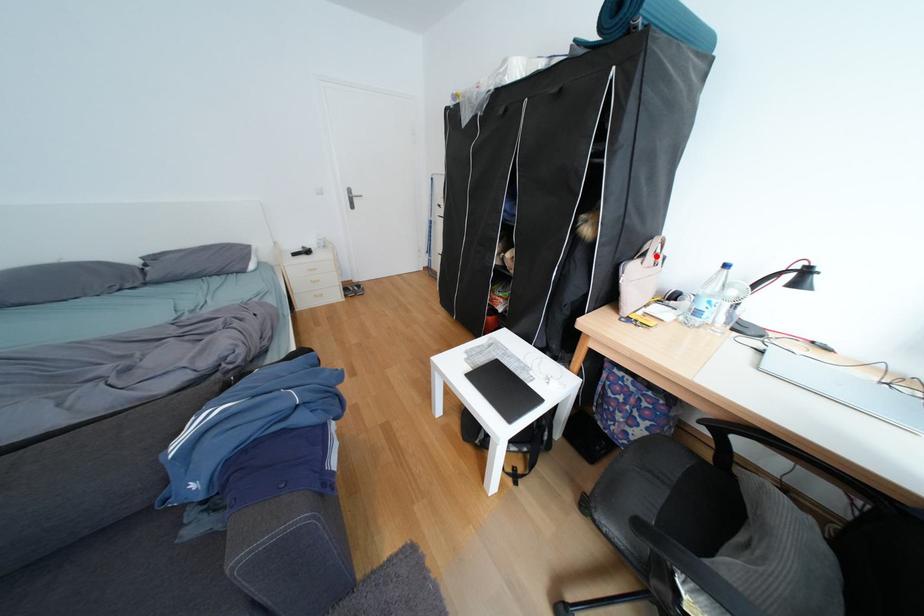
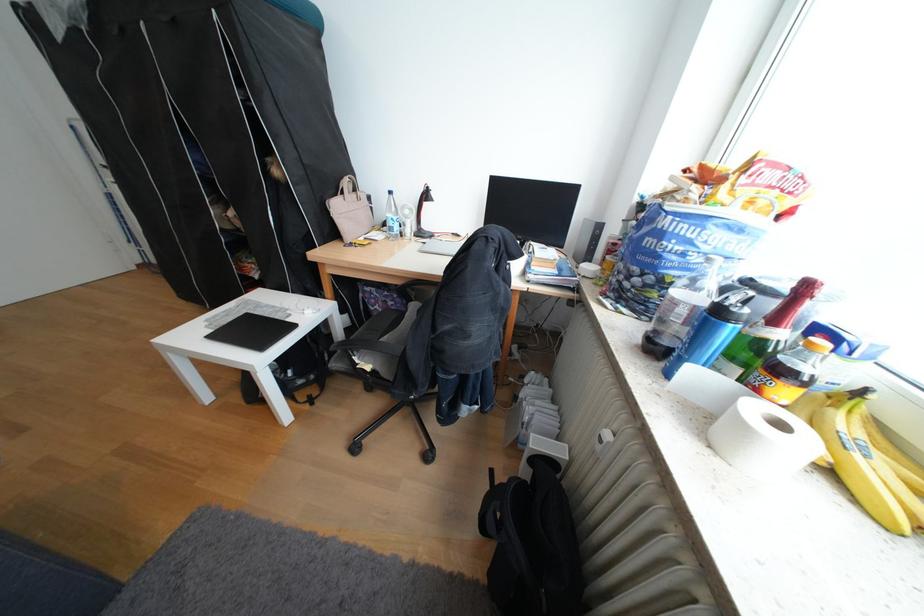
Question: I am providing you with two images of the same scene from different viewpoints. In image1, a red point is highlighted. Considering the same 3D point in image2, which of the following is correct?

Choices:
 (A) It is closer
 (B) It is farther

Answer: (A)